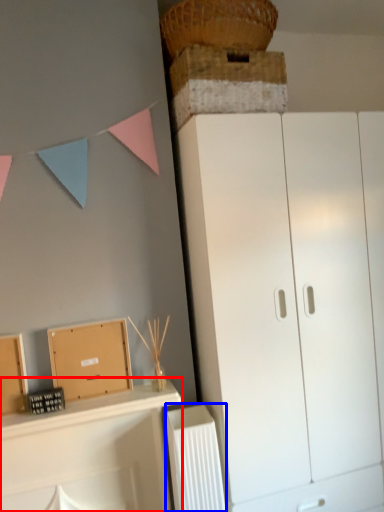
Question: Which object appears farthest to the camera in this image, shelf (highlighted by a red box) or radiator (highlighted by a blue box)?

Choices:
 (A) shelf
 (B) radiator

Answer: (B)